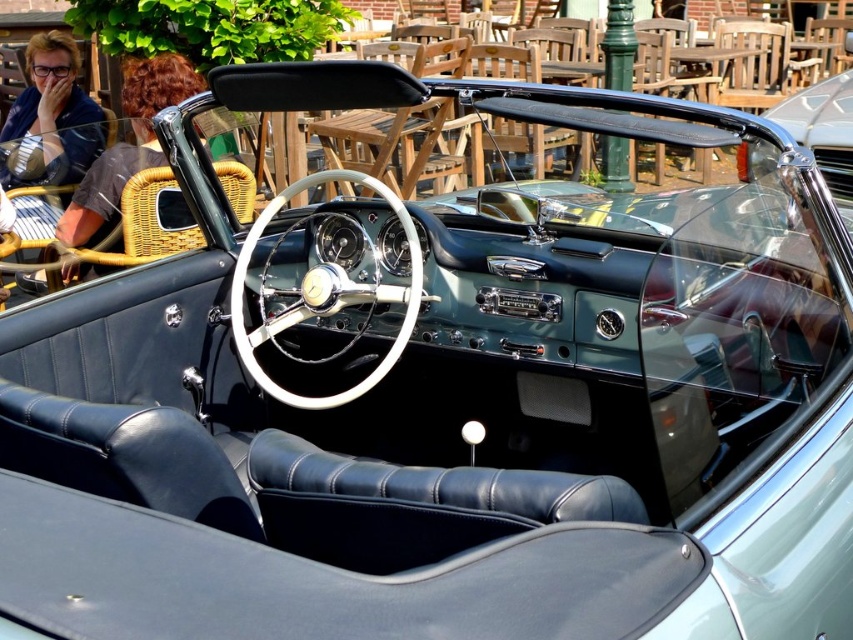
Can you confirm if shiny silver steering wheel at center is shorter than metallic silver steering wheel at center?

Incorrect, shiny silver steering wheel at center's height does not fall short of metallic silver steering wheel at center's.

Can you confirm if shiny silver steering wheel at center is positioned above metallic silver steering wheel at center?

No.

Which is in front, point (96, 176) or point (819, 163)?

Point (96, 176) is more forward.

You are a GUI agent. You are given a task and a screenshot of the screen. Output one action in this format:
    pyautogui.click(x=<x>, y=<y>)
    Task: Click on the shiny silver steering wheel at center
    
    Given the screenshot: What is the action you would take?
    pyautogui.click(x=126, y=145)